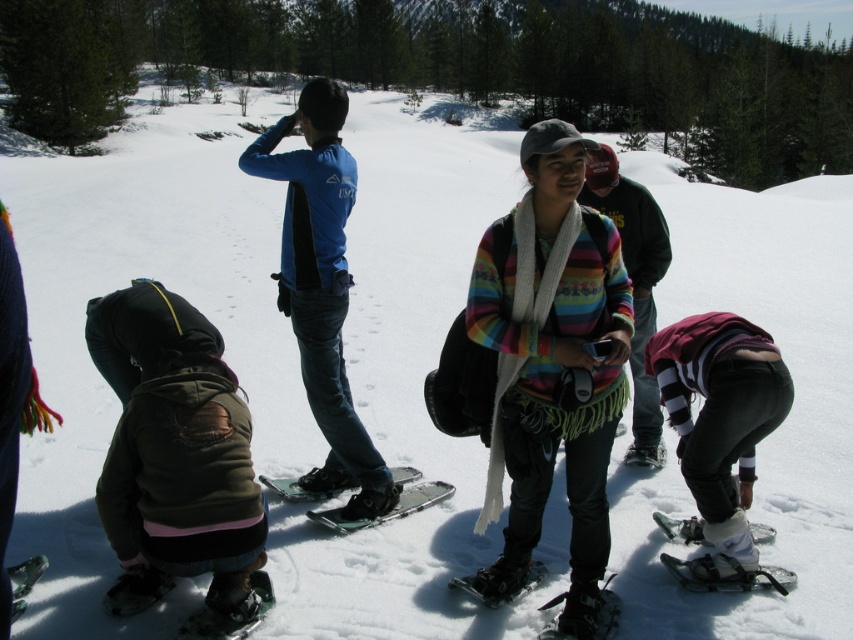
Question: Which object is closer to the camera taking this photo?

Choices:
 (A) green rubber snowshoe at lower left
 (B) green metallic ski at center
 (C) white matte ski at lower right
 (D) striped sweater at center

Answer: (A)

Question: Can you confirm if green metallic ski at center is positioned to the right of green rubber snowshoe at lower left?

Choices:
 (A) yes
 (B) no

Answer: (A)

Question: Estimate the real-world distances between objects in this image. Which object is farther from the striped sweater at center?

Choices:
 (A) silver metallic snowshoe at center
 (B) dark green fleece jacket at lower left
 (C) green matte ski at lower left

Answer: (C)

Question: Does dark green fleece jacket at lower left come behind black rubber snowshoe at lower center?

Choices:
 (A) no
 (B) yes

Answer: (A)

Question: Estimate the real-world distances between objects in this image. Which object is farther from the white matte snowshoe at center?

Choices:
 (A) silver metallic snowshoe at center
 (B) green metallic ski at center

Answer: (A)

Question: Does black rubber snowshoe at lower center appear on the left side of white matte ski at lower right?

Choices:
 (A) no
 (B) yes

Answer: (B)